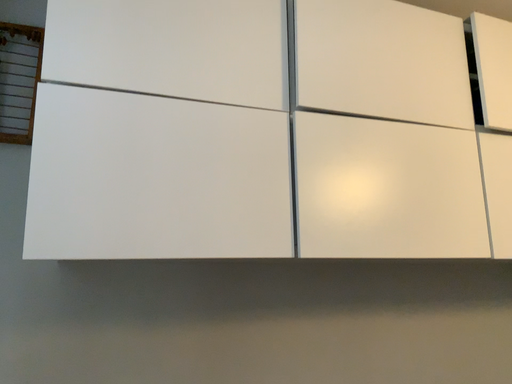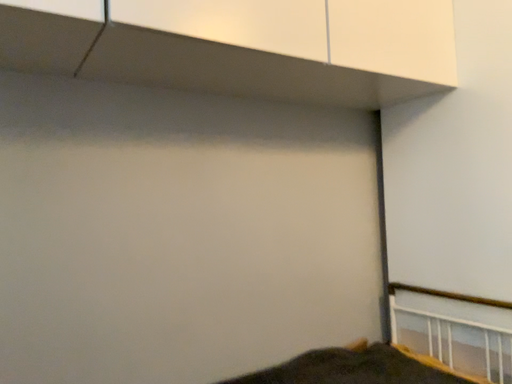
Question: Which way did the camera rotate in the video?

Choices:
 (A) rotated upward
 (B) rotated downward

Answer: (B)